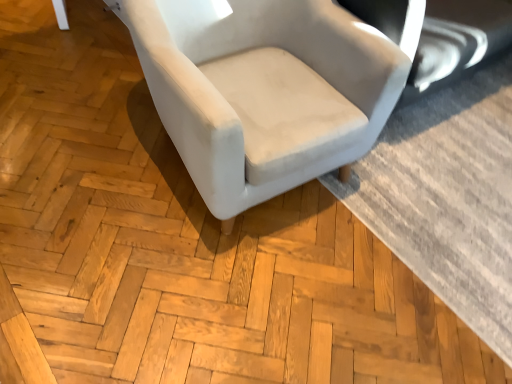
The image size is (512, 384). What are the coordinates of `vacant area that is in front of white velvet chair at center` in the screenshot? It's located at (203, 284).